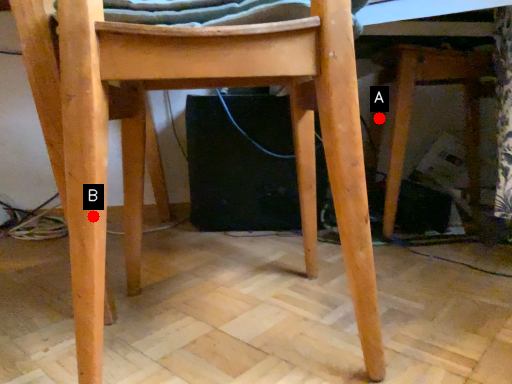
Question: Two points are circled on the image, labeled by A and B beside each circle. Among these points, which one is farthest from the camera?

Choices:
 (A) A is further
 (B) B is further

Answer: (A)